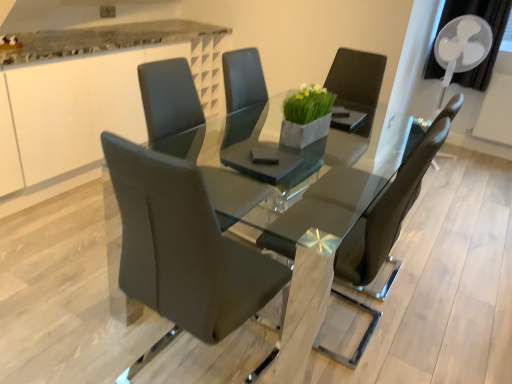
Question: Can you confirm if matte black chair at center, which is counted as the 2th chair, starting from the back, is wider than white plastic mechanical fan at upper right?

Choices:
 (A) no
 (B) yes

Answer: (B)

Question: Could white plastic mechanical fan at upper right be considered to be inside matte black chair at center, which is counted as the 2th chair, starting from the back?

Choices:
 (A) no
 (B) yes

Answer: (A)

Question: Can you confirm if matte black chair at center, which is the 2th chair in front-to-back order, is positioned to the left of white plastic mechanical fan at upper right?

Choices:
 (A) yes
 (B) no

Answer: (A)

Question: Is matte black chair at center, which is counted as the 2th chair, starting from the back, at the right side of white plastic mechanical fan at upper right?

Choices:
 (A) no
 (B) yes

Answer: (A)

Question: Can you confirm if matte black chair at center, which is counted as the 2th chair, starting from the back, is taller than white plastic mechanical fan at upper right?

Choices:
 (A) no
 (B) yes

Answer: (B)

Question: Considering the positions of matte black chair at center, placed as the first chair when sorted from back to front, and matte black chair at center, which is the 2th chair in front-to-back order, in the image, is matte black chair at center, placed as the first chair when sorted from back to front, wider or thinner than matte black chair at center, which is the 2th chair in front-to-back order,?

Choices:
 (A) thin
 (B) wide

Answer: (A)

Question: Is matte black chair at center, positioned as the third chair in front-to-back order, inside the boundaries of matte black chair at center, which is the 2th chair in front-to-back order, or outside?

Choices:
 (A) inside
 (B) outside

Answer: (B)

Question: In terms of size, does matte black chair at center, placed as the first chair when sorted from back to front, appear bigger or smaller than matte black chair at center, which is counted as the 2th chair, starting from the back?

Choices:
 (A) big
 (B) small

Answer: (B)

Question: Considering their positions, is matte black chair at center, placed as the first chair when sorted from back to front, located in front of or behind matte black chair at center, which is the 2th chair in front-to-back order?

Choices:
 (A) behind
 (B) front

Answer: (A)

Question: Is point (141, 266) positioned closer to the camera than point (231, 69)?

Choices:
 (A) closer
 (B) farther

Answer: (A)

Question: Is high-gloss black table at center situated inside matte black chair at center, positioned as the third chair in front-to-back order, or outside?

Choices:
 (A) inside
 (B) outside

Answer: (B)

Question: In terms of size, does high-gloss black table at center appear bigger or smaller than matte black chair at center, placed as the first chair when sorted from back to front?

Choices:
 (A) small
 (B) big

Answer: (B)

Question: In terms of height, does high-gloss black table at center look taller or shorter compared to matte black chair at center, placed as the first chair when sorted from back to front?

Choices:
 (A) short
 (B) tall

Answer: (B)

Question: In the image, is high-gloss black table at center positioned in front of or behind white glossy counter at upper left?

Choices:
 (A) front
 (B) behind

Answer: (A)

Question: From a real-world perspective, is high-gloss black table at center above or below white glossy counter at upper left?

Choices:
 (A) above
 (B) below

Answer: (B)